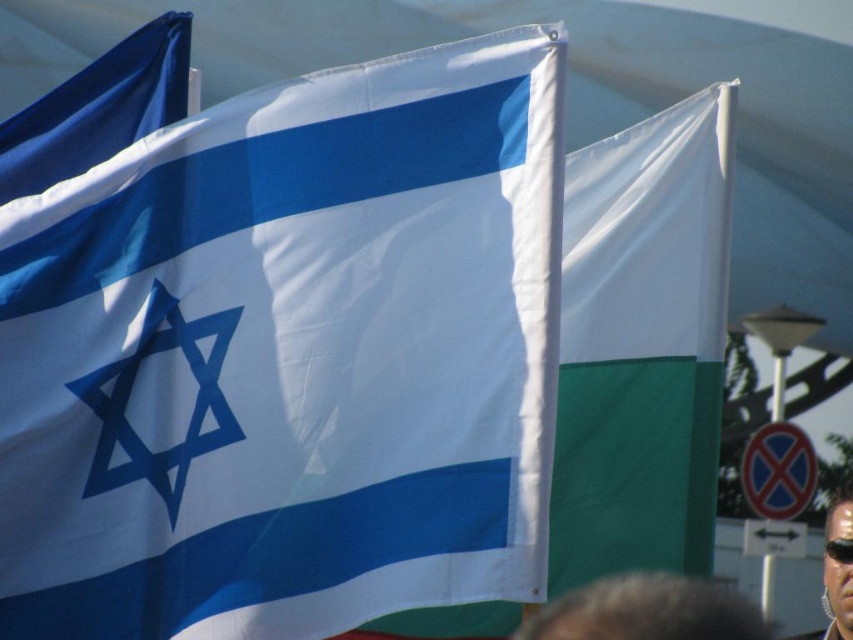
You are a customer at an eyewear store and see two items displayed in the window. The sunglasses at upper right and the transparent plastic goggles at lower right. Which item has a larger width?

The sunglasses at upper right might be wider than transparent plastic goggles at lower right, so the sunglasses at upper right likely has a larger width.

You are a drone operator trying to locate a specific point in an image. The point you need to find is at coordinates point (x=97, y=108). According to the scene description, which object is located at this coordinate?

The point (x=97, y=108) corresponds to the blue fabric flag at upper left as per the objects description.